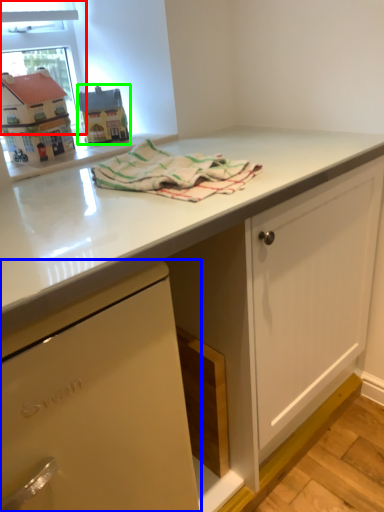
Question: Which object is positioned closest to window screen (highlighted by a red box)? Select from cabinetry (highlighted by a blue box) and appliance (highlighted by a green box).

Choices:
 (A) cabinetry
 (B) appliance

Answer: (B)